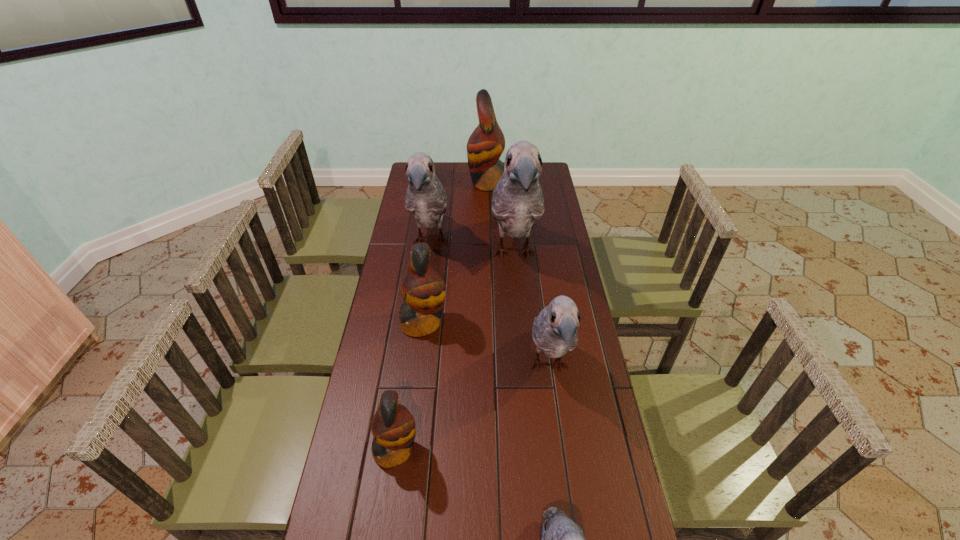
Locate an element on the screen. This screenshot has height=540, width=960. free space located 0.060m on the face of the rightmost red parrot is located at coordinates (455, 183).

Find the location of `free space located 0.230m on the face of the rightmost red parrot`. free space located 0.230m on the face of the rightmost red parrot is located at coordinates point(421,183).

Where is `vacant region located on the face of the rightmost red parrot`? vacant region located on the face of the rightmost red parrot is located at coordinates (440, 183).

This screenshot has width=960, height=540. Identify the location of free spot located on the front-facing side of the third smallest gray parrot. (425, 282).

The height and width of the screenshot is (540, 960). I want to click on vacant region located 0.260m on the face of the second biggest red parrot, so click(x=521, y=322).

The width and height of the screenshot is (960, 540). Identify the location of vacant area situated 0.130m on the front-facing side of the second nearest gray parrot. (561, 454).

This screenshot has width=960, height=540. In order to click on free spot located on the face of the second nearest object in this screenshot , I will do `click(546, 450)`.

Locate an element on the screen. The image size is (960, 540). object that is at the far edge is located at coordinates (486, 144).

Where is `blank space at the left edge`? This screenshot has width=960, height=540. blank space at the left edge is located at coordinates (425, 228).

In the image, there is a desktop. Where is `vacant space at the right edge`? vacant space at the right edge is located at coordinates (555, 244).